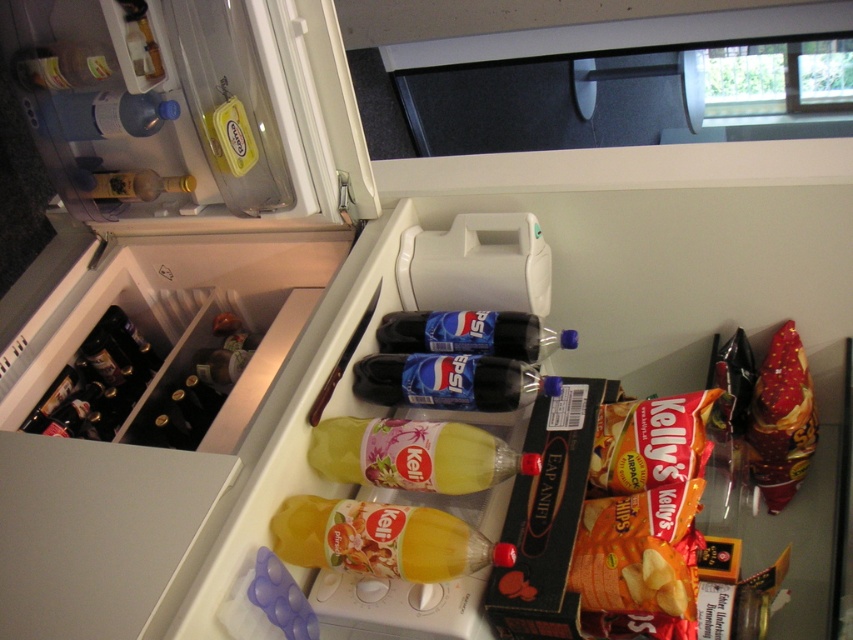
Does translucent yellow bottle at center have a larger size compared to glossy plastic pepsi bottle at center?

Yes.

Does point (309, 518) lie behind point (445, 381)?

No, it is not.

You are a GUI agent. You are given a task and a screenshot of the screen. Output one action in this format:
    pyautogui.click(x=<x>, y=<y>)
    Task: Click on the translucent yellow bottle at center
    
    Given the screenshot: What is the action you would take?
    pyautogui.click(x=381, y=540)

Who is taller, translucent yellow bottle at center or orange matte snack packet at lower right?

Standing taller between the two is orange matte snack packet at lower right.

Does translucent yellow bottle at center have a lesser height compared to orange matte snack packet at lower right?

Indeed, translucent yellow bottle at center has a lesser height compared to orange matte snack packet at lower right.

Is point (277, 515) positioned before point (650, 557)?

No, (277, 515) is further to viewer.

You are a GUI agent. You are given a task and a screenshot of the screen. Output one action in this format:
    pyautogui.click(x=<x>, y=<y>)
    Task: Click on the translucent yellow bottle at center
    
    Given the screenshot: What is the action you would take?
    pyautogui.click(x=381, y=540)

Is point (38, 406) positioned in front of point (786, 419)?

That is False.

Does dark brown glass bottles at lower left appear over shiny red plastic bag of chips at right?

Yes.

Is point (99, 400) positioned after point (790, 371)?

Yes, it is behind point (790, 371).

Locate an element on the screen. This screenshot has width=853, height=640. dark brown glass bottles at lower left is located at coordinates (97, 381).